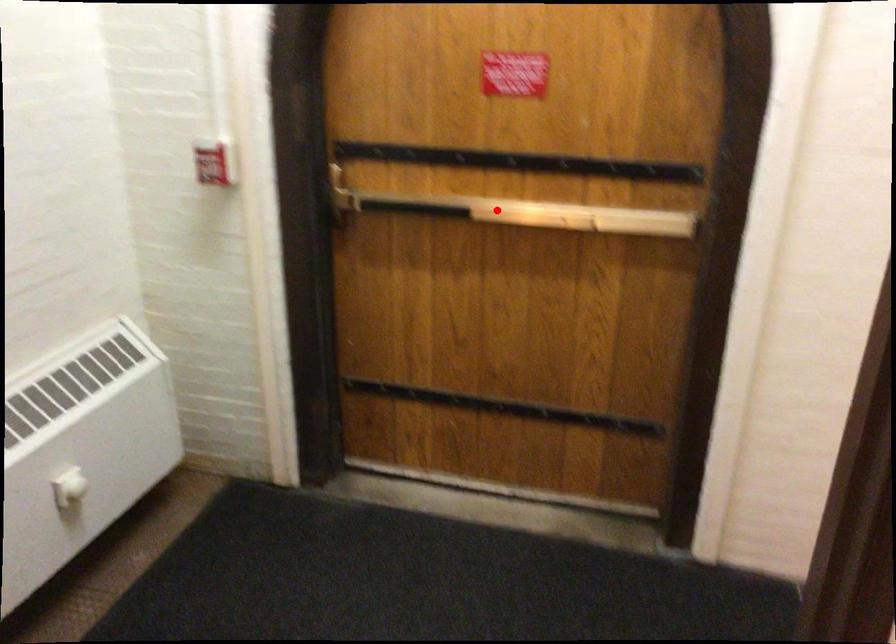
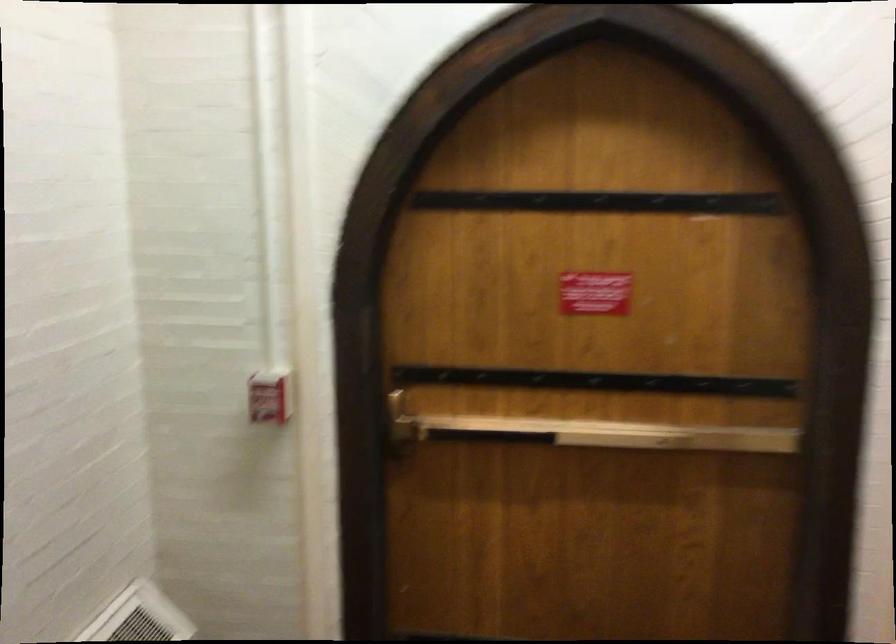
The point at the highlighted location is marked in the first image. Where is the corresponding point in the second image?

(595, 433)